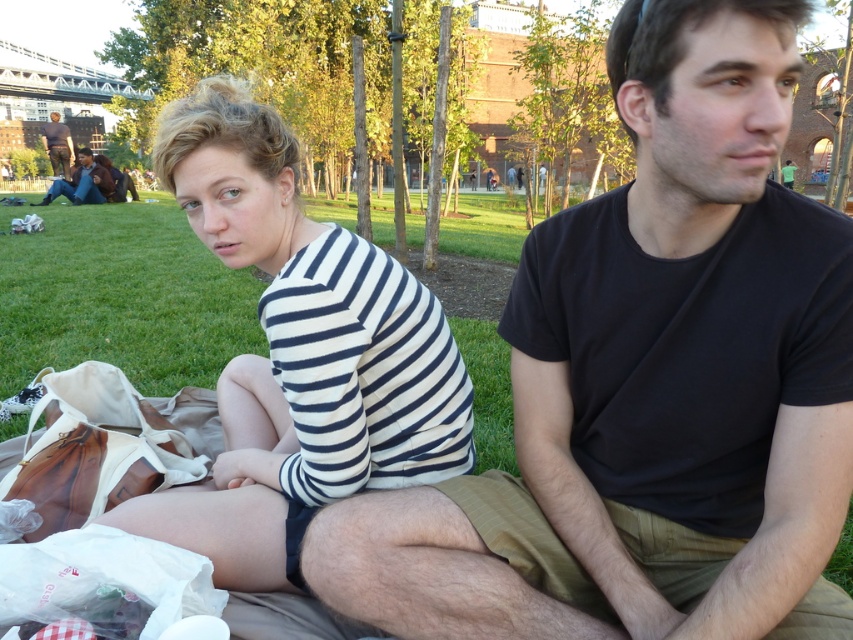
You are a photographer trying to capture a candid shot of the two people sitting on the grass. You notice the white striped shirt at center and the brown leather jacket at lower left. Which object is shorter in height?

The white striped shirt at center has a lesser height compared to the brown leather jacket at lower left, so the white striped shirt at center is shorter in height.